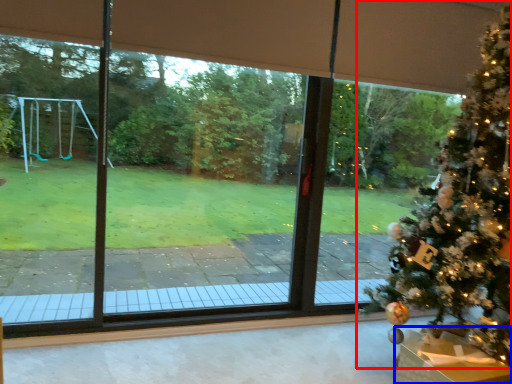
Question: Which of the following is the closest to the observer, christmas tree (highlighted by a red box) or furniture (highlighted by a blue box)?

Choices:
 (A) christmas tree
 (B) furniture

Answer: (A)